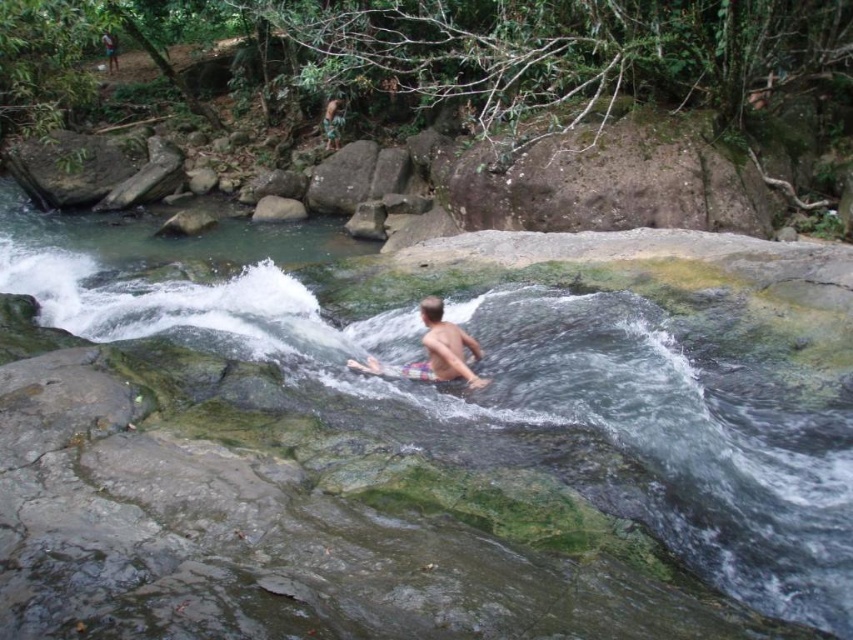
Question: Observing the image, what is the correct spatial positioning of clear water at stream center in reference to plaid shorts at center?

Choices:
 (A) above
 (B) below

Answer: (A)

Question: Among these objects, which one is farthest from the camera?

Choices:
 (A) plaid shorts at center
 (B) clear water at stream center

Answer: (A)

Question: Which point appears closest to the camera in this image?

Choices:
 (A) (424, 376)
 (B) (287, 333)

Answer: (A)

Question: Where is clear water at stream center located in relation to plaid shorts at center in the image?

Choices:
 (A) below
 (B) above

Answer: (B)

Question: Is clear water at stream center above plaid shorts at center?

Choices:
 (A) no
 (B) yes

Answer: (B)

Question: Among these points, which one is farthest from the camera?

Choices:
 (A) (631, 301)
 (B) (372, 364)

Answer: (A)